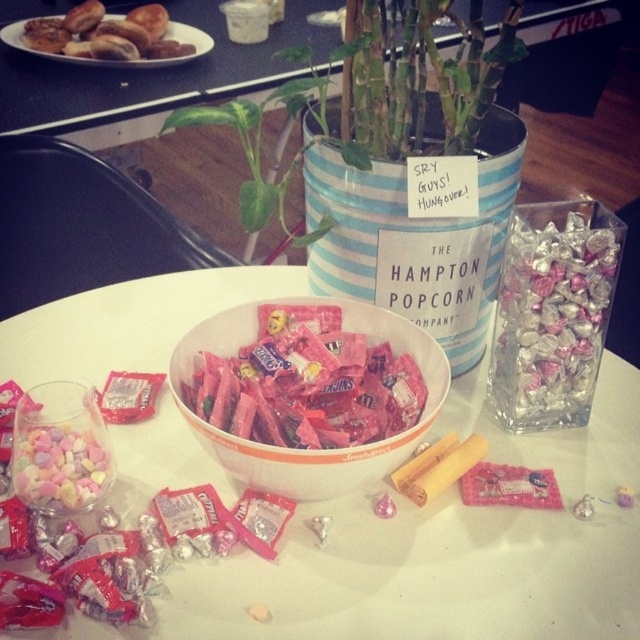
You are at a party and want to grab a candy from the silver foil wrapped chocolates at right and the pink matte candy bowl at center. Which one is more to the right?

The silver foil wrapped chocolates at right is more to the right because it is positioned on the right side of the pink matte candy bowl at center.